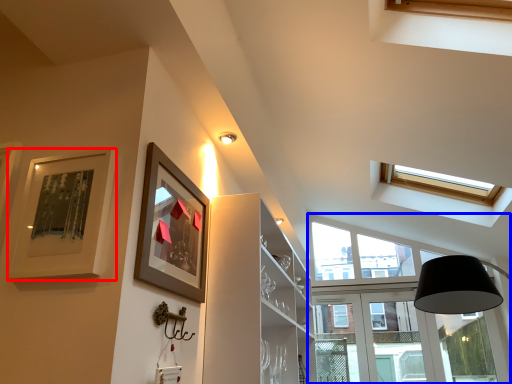
Question: Which point is further to the camera, picture frame (highlighted by a red box) or window (highlighted by a blue box)?

Choices:
 (A) picture frame
 (B) window

Answer: (B)